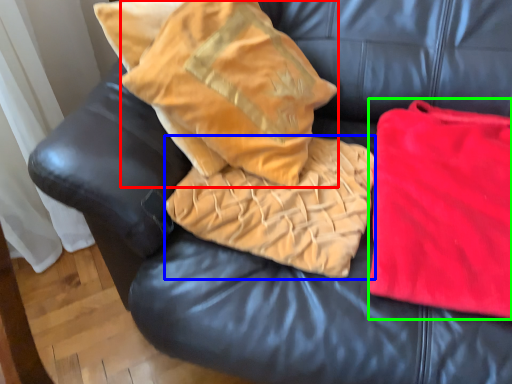
Question: Considering the real-world distances, which object is farthest from throw pillow (highlighted by a red box)? cloth (highlighted by a blue box) or material (highlighted by a green box)?

Choices:
 (A) cloth
 (B) material

Answer: (B)